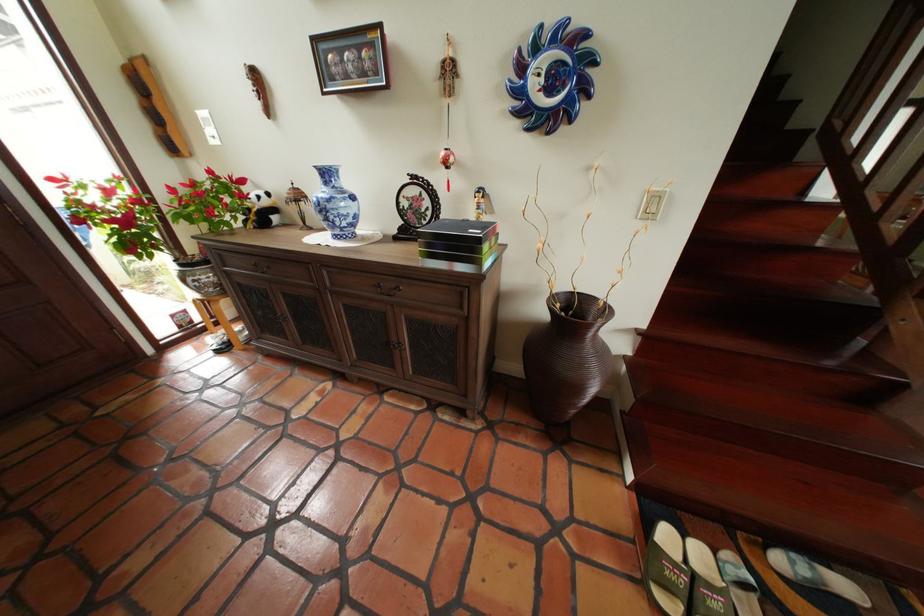
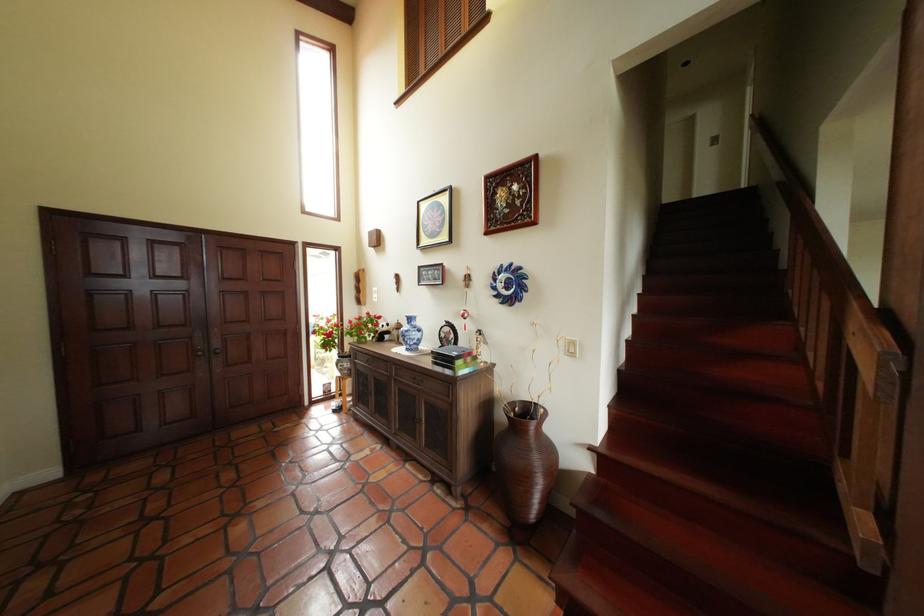
Locate, in the second image, the point that corresponds to (x=341, y=214) in the first image.

(418, 338)